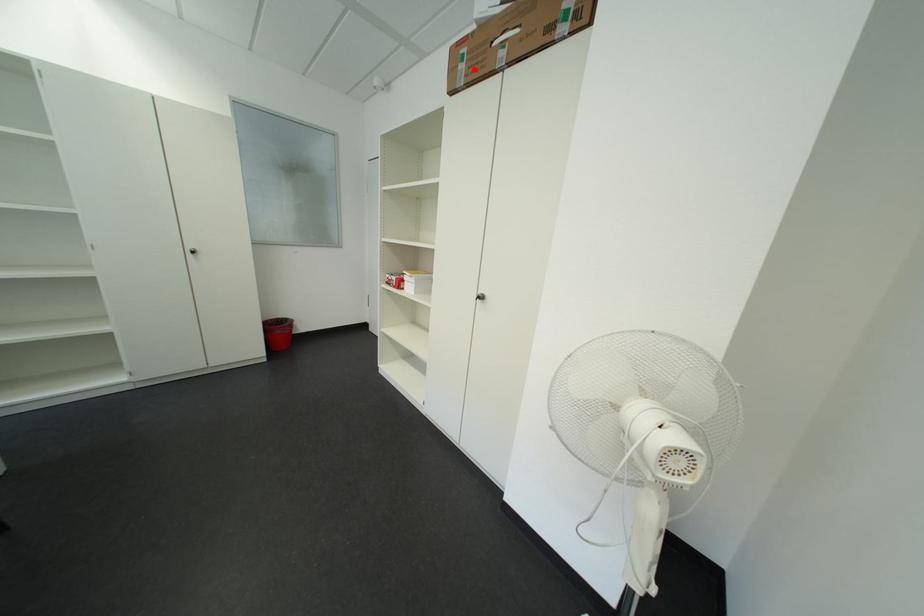
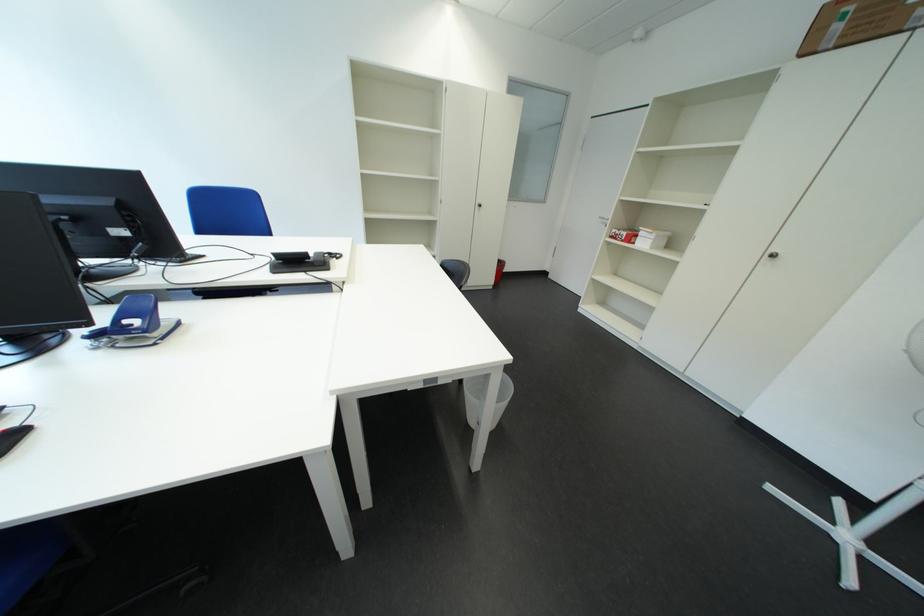
The point at the highlighted location is marked in the first image. Where is the corresponding point in the second image?

(849, 30)